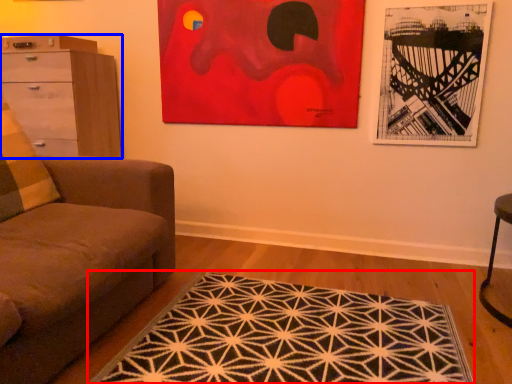
Question: Among these objects, which one is nearest to the camera, mat (highlighted by a red box) or chest of drawers (highlighted by a blue box)?

Choices:
 (A) mat
 (B) chest of drawers

Answer: (A)